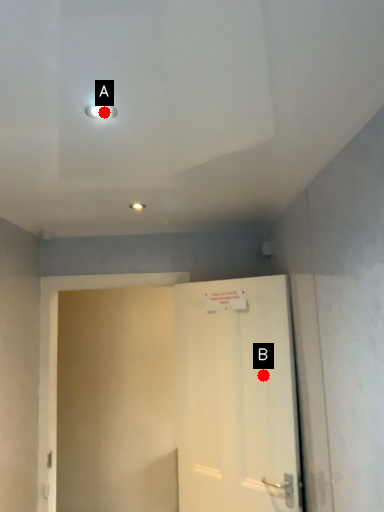
Question: Two points are circled on the image, labeled by A and B beside each circle. Which point is closer to the camera?

Choices:
 (A) A is closer
 (B) B is closer

Answer: (A)